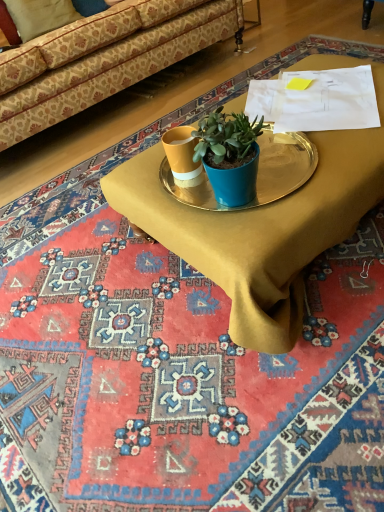
Locate an element on the screen. Image resolution: width=384 pixels, height=512 pixels. patterned fabric couch at upper left is located at coordinates (105, 68).

The width and height of the screenshot is (384, 512). Describe the element at coordinates (257, 174) in the screenshot. I see `metallic gold tray at center` at that location.

Where is `beige fabric pillow at upper left`? The height and width of the screenshot is (512, 384). beige fabric pillow at upper left is located at coordinates (34, 17).

Consider the image. From the image's perspective, is beige fabric pillow at upper left below metallic gold tray at center?

No.

From a real-world perspective, is beige fabric pillow at upper left over metallic gold tray at center?

Yes, from a real-world perspective, beige fabric pillow at upper left is over metallic gold tray at center

Which is less distant, (25, 30) or (171, 183)?

The point (171, 183) is more forward.

Locate an element on the screen. The image size is (384, 512). round table lying below the beige fabric pillow at upper left (from the image's perspective) is located at coordinates pos(257,174).

From a real-world perspective, is metallic gold tray at center physically below metallic gold tray at center?

Yes, from a real-world perspective, metallic gold tray at center is below metallic gold tray at center.

Which of these two, metallic gold tray at center or metallic gold tray at center, stands shorter?

Standing shorter between the two is metallic gold tray at center.

You are a GUI agent. You are given a task and a screenshot of the screen. Output one action in this format:
    pyautogui.click(x=<x>, y=<y>)
    Task: Click on the round table on the left of the metallic gold tray at center
    
    Given the screenshot: What is the action you would take?
    pyautogui.click(x=257, y=174)

Measure the distance from metallic gold tray at center to metallic gold tray at center.

The distance of metallic gold tray at center from metallic gold tray at center is 4.72 inches.

Is metallic gold tray at center situated inside patterned fabric couch at upper left or outside?

metallic gold tray at center cannot be found inside patterned fabric couch at upper left.

I want to click on studio couch on the left of the metallic gold tray at center, so click(x=105, y=68).

Is metallic gold tray at center touching patterned fabric couch at upper left?

There is a gap between metallic gold tray at center and patterned fabric couch at upper left.

Consider the image. Between beige fabric pillow at upper left and patterned fabric couch at upper left, which one has smaller size?

Smaller between the two is beige fabric pillow at upper left.

Is beige fabric pillow at upper left in front of or behind patterned fabric couch at upper left in the image?

beige fabric pillow at upper left is positioned farther from the viewer than patterned fabric couch at upper left.

From a real-world perspective, is beige fabric pillow at upper left physically above patterned fabric couch at upper left?

Yes.

From the image's perspective, relative to patterned fabric couch at upper left, is beige fabric pillow at upper left above or below?

beige fabric pillow at upper left is situated higher than patterned fabric couch at upper left in the image.

Which is more to the right, patterned fabric couch at upper left or metallic gold tray at center?

From the viewer's perspective, metallic gold tray at center appears more on the right side.

Which of these two, patterned fabric couch at upper left or metallic gold tray at center, is bigger?

With larger size is patterned fabric couch at upper left.

From the image's perspective, who appears lower, patterned fabric couch at upper left or metallic gold tray at center?

metallic gold tray at center appears lower in the image.

How many degrees apart are the facing directions of patterned fabric couch at upper left and metallic gold tray at center?

The angular difference between patterned fabric couch at upper left and metallic gold tray at center is 178 degrees.

Locate an element on the screen. The height and width of the screenshot is (512, 384). pillow that appears behind the metallic gold tray at center is located at coordinates (34, 17).

Is metallic gold tray at center with beige fabric pillow at upper left?

metallic gold tray at center and beige fabric pillow at upper left are not in contact.

Which object is positioned more to the right, metallic gold tray at center or beige fabric pillow at upper left?

metallic gold tray at center.

Between point (331, 131) and point (28, 33), which one is positioned behind?

The point (28, 33) is behind.

Does beige fabric pillow at upper left contain metallic gold tray at center?

No, beige fabric pillow at upper left does not contain metallic gold tray at center.

Is beige fabric pillow at upper left next to metallic gold tray at center and touching it?

beige fabric pillow at upper left and metallic gold tray at center are not in contact.

Would you say beige fabric pillow at upper left is to the left or to the right of metallic gold tray at center in the picture?

Clearly, beige fabric pillow at upper left is on the left of metallic gold tray at center in the image.

Identify the location of pillow that is behind the metallic gold tray at center. The image size is (384, 512). (34, 17).

I want to click on pillow on the left of metallic gold tray at center, so click(x=34, y=17).

Where is `desk in front of the metallic gold tray at center`? This screenshot has width=384, height=512. desk in front of the metallic gold tray at center is located at coordinates (262, 228).

Based on their spatial positions, is metallic gold tray at center or patterned fabric couch at upper left closer to metallic gold tray at center?

metallic gold tray at center is positioned closer to the anchor metallic gold tray at center.

Which object lies nearer to the anchor point metallic gold tray at center, metallic gold tray at center or beige fabric pillow at upper left?

The object closer to metallic gold tray at center is metallic gold tray at center.

Considering their positions, is metallic gold tray at center positioned further to patterned fabric couch at upper left than metallic gold tray at center?

metallic gold tray at center lies further to patterned fabric couch at upper left than the other object.

Looking at the image, which one is located closer to patterned fabric couch at upper left, metallic gold tray at center or beige fabric pillow at upper left?

Among the two, beige fabric pillow at upper left is located nearer to patterned fabric couch at upper left.

In the scene shown: Looking at the image, which one is located closer to beige fabric pillow at upper left, metallic gold tray at center or metallic gold tray at center?

metallic gold tray at center is closer to beige fabric pillow at upper left.

Looking at the image, which one is located closer to metallic gold tray at center, metallic gold tray at center or beige fabric pillow at upper left?

metallic gold tray at center lies closer to metallic gold tray at center than the other object.

Based on their spatial positions, is metallic gold tray at center or patterned fabric couch at upper left closer to beige fabric pillow at upper left?

patterned fabric couch at upper left is closer to beige fabric pillow at upper left.

Looking at the image, which one is located further to metallic gold tray at center, patterned fabric couch at upper left or metallic gold tray at center?

Among the two, patterned fabric couch at upper left is located further to metallic gold tray at center.

Where is `studio couch between beige fabric pillow at upper left and metallic gold tray at center vertically`? This screenshot has width=384, height=512. studio couch between beige fabric pillow at upper left and metallic gold tray at center vertically is located at coordinates (105, 68).

The image size is (384, 512). What are the coordinates of `desk between patterned fabric couch at upper left and metallic gold tray at center in the vertical direction` in the screenshot? It's located at (262, 228).

At what (x,y) coordinates should I click in order to perform the action: click on round table between metallic gold tray at center and beige fabric pillow at upper left along the z-axis. Please return your answer as a coordinate pair (x, y). This screenshot has width=384, height=512. Looking at the image, I should click on (257, 174).

The width and height of the screenshot is (384, 512). I want to click on studio couch situated between beige fabric pillow at upper left and metallic gold tray at center from left to right, so click(105, 68).